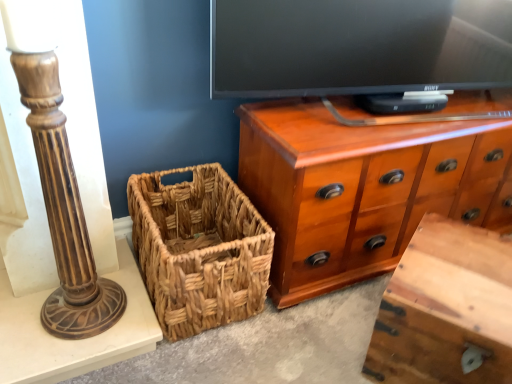
Question: Considering the relative positions of wooden vanity at lower right and woven brown picnic basket at lower left in the image provided, is wooden vanity at lower right to the left or to the right of woven brown picnic basket at lower left?

Choices:
 (A) left
 (B) right

Answer: (B)

Question: Looking at their shapes, would you say wooden vanity at lower right is wider or thinner than woven brown picnic basket at lower left?

Choices:
 (A) wide
 (B) thin

Answer: (B)

Question: Which object is positioned closest to the shiny brown wood chest of drawers at upper right?

Choices:
 (A) wooden vanity at lower right
 (B) woven brown picnic basket at lower left
 (C) brown polished wood candlestick at left

Answer: (B)

Question: Considering the real-world distances, which object is farthest from the wooden vanity at lower right?

Choices:
 (A) shiny brown wood chest of drawers at upper right
 (B) woven brown picnic basket at lower left
 (C) brown polished wood candlestick at left

Answer: (C)